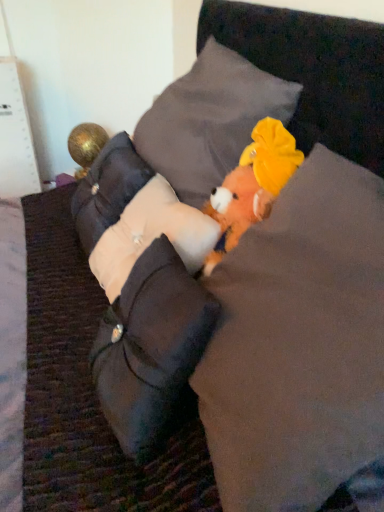
Question: Is fluffy orange plush toy at center positioned far away from white fabric pillow at center, which is the third pillow in top-to-bottom order?

Choices:
 (A) no
 (B) yes

Answer: (A)

Question: Does fluffy orange plush toy at center appear on the left side of white fabric pillow at center, the 2th pillow when ordered from bottom to top?

Choices:
 (A) no
 (B) yes

Answer: (A)

Question: Does fluffy orange plush toy at center turn towards white fabric pillow at center, which is the third pillow in top-to-bottom order?

Choices:
 (A) yes
 (B) no

Answer: (B)

Question: From the image's perspective, is fluffy orange plush toy at center above white fabric pillow at center, the 2th pillow when ordered from bottom to top?

Choices:
 (A) yes
 (B) no

Answer: (B)

Question: Is fluffy orange plush toy at center in front of white fabric pillow at center, the 2th pillow when ordered from bottom to top?

Choices:
 (A) yes
 (B) no

Answer: (A)

Question: From a real-world perspective, is white fabric pillow at center, which ranks as the fourth pillow in top-to-bottom order, physically located above or below velvet gray pillow at center, which ranks as the 4th pillow in bottom-to-top order?

Choices:
 (A) above
 (B) below

Answer: (B)

Question: Based on their sizes in the image, would you say white fabric pillow at center, which ranks as the fourth pillow in top-to-bottom order, is bigger or smaller than velvet gray pillow at center, which ranks as the 4th pillow in bottom-to-top order?

Choices:
 (A) small
 (B) big

Answer: (A)

Question: From the image's perspective, relative to velvet gray pillow at center, which ranks as the 4th pillow in bottom-to-top order, is white fabric pillow at center, which ranks as the fourth pillow in top-to-bottom order, above or below?

Choices:
 (A) below
 (B) above

Answer: (A)

Question: Looking at their shapes, would you say white fabric pillow at center, the 1th pillow ordered from the bottom, is wider or thinner than velvet gray pillow at center, positioned as the first pillow in top-to-bottom order?

Choices:
 (A) thin
 (B) wide

Answer: (A)

Question: Considering the positions of gold metallic ball at left, which is counted as the first toy, starting from the left, and fluffy orange plush toy at center, arranged as the first toy when viewed from the right, in the image, is gold metallic ball at left, which is counted as the first toy, starting from the left, taller or shorter than fluffy orange plush toy at center, arranged as the first toy when viewed from the right,?

Choices:
 (A) short
 (B) tall

Answer: (B)

Question: Is point (89, 143) closer or farther from the camera than point (248, 150)?

Choices:
 (A) farther
 (B) closer

Answer: (A)

Question: Looking at the image, does gold metallic ball at left, the first toy in the top-to-bottom sequence, seem bigger or smaller compared to fluffy orange plush toy at center, the second toy when ordered from back to front?

Choices:
 (A) big
 (B) small

Answer: (A)

Question: From the image's perspective, is gold metallic ball at left, which is counted as the first toy, starting from the left, positioned above or below fluffy orange plush toy at center, the second toy when ordered from back to front?

Choices:
 (A) above
 (B) below

Answer: (A)

Question: Is fluffy orange plush toy at center taller or shorter than white fabric pillow at center, the 1th pillow ordered from the bottom?

Choices:
 (A) tall
 (B) short

Answer: (A)

Question: From a real-world perspective, is fluffy orange plush toy at center above or below white fabric pillow at center, the 1th pillow ordered from the bottom?

Choices:
 (A) above
 (B) below

Answer: (A)